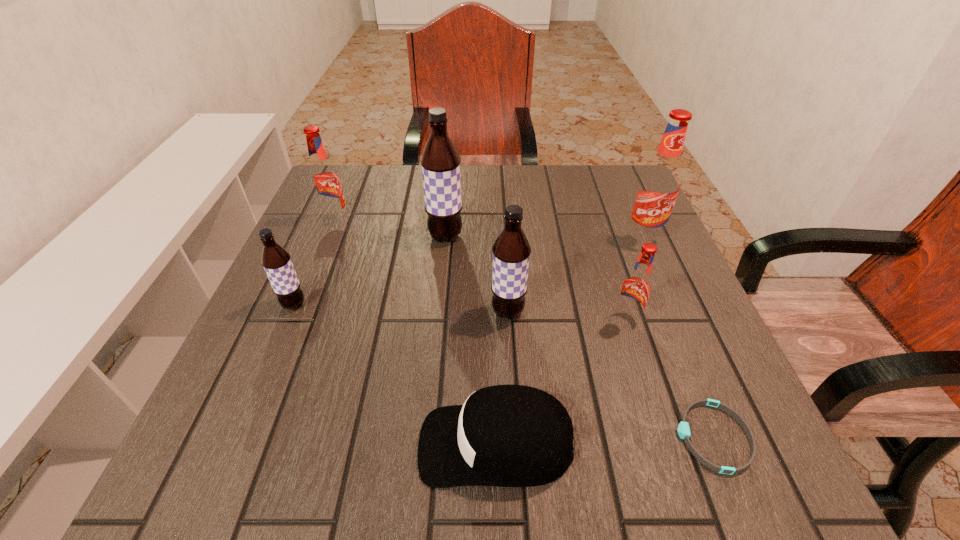
Identify the location of the rightmost red root beer. This screenshot has width=960, height=540. (660, 182).

The width and height of the screenshot is (960, 540). I want to click on the rightmost root beer, so click(x=660, y=182).

Identify the location of the biggest brown root beer. This screenshot has height=540, width=960. (440, 161).

Identify the location of the third root beer from left to right. click(x=440, y=161).

You are a GUI agent. You are given a task and a screenshot of the screen. Output one action in this format:
    pyautogui.click(x=<x>, y=<y>)
    Task: Click on the second smallest red root beer
    
    Given the screenshot: What is the action you would take?
    pyautogui.click(x=324, y=180)

Locate an element on the screen. the fourth root beer from left to right is located at coordinates (511, 251).

Where is `the rightmost brown root beer`? the rightmost brown root beer is located at coordinates (511, 251).

Locate an element on the screen. This screenshot has height=540, width=960. the smallest brown root beer is located at coordinates (276, 261).

In order to click on the second root beer from right to left in this screenshot , I will do `click(636, 288)`.

This screenshot has height=540, width=960. I want to click on the nearest red root beer, so click(x=636, y=288).